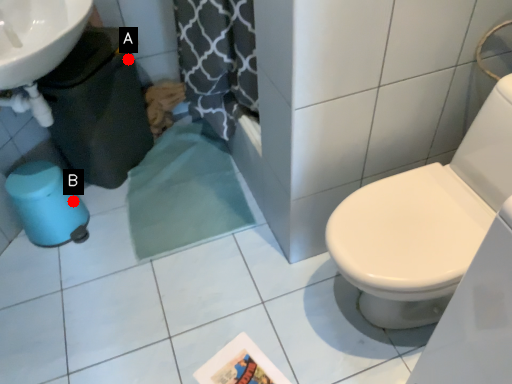
Question: Two points are circled on the image, labeled by A and B beside each circle. Which point is closer to the camera taking this photo?

Choices:
 (A) A is closer
 (B) B is closer

Answer: (B)